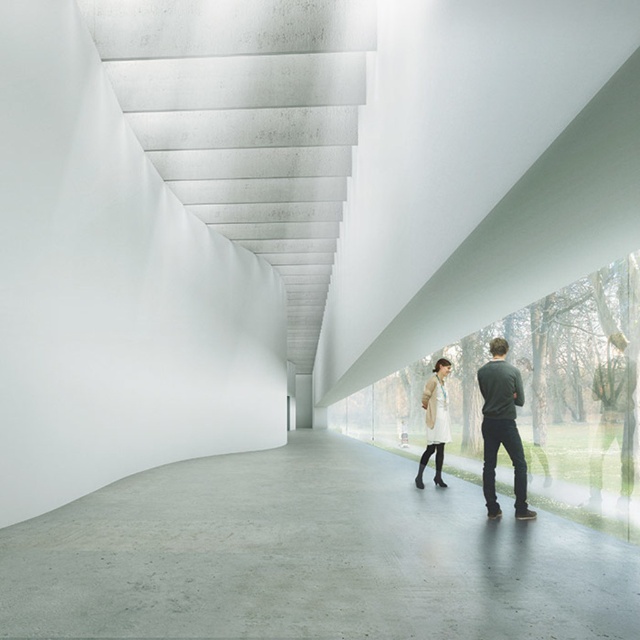
Question: Is gray polished concrete floor at center smaller than dark green sweater at center?

Choices:
 (A) yes
 (B) no

Answer: (B)

Question: Which of the following is the farthest from the observer?

Choices:
 (A) light beige sweater at center
 (B) gray polished concrete floor at center

Answer: (A)

Question: Estimate the real-world distances between objects in this image. Which object is closer to the gray polished concrete floor at center?

Choices:
 (A) beige wool coat at center
 (B) light beige sweater at center

Answer: (B)

Question: Is gray polished concrete floor at center in front of dark green sweater at center?

Choices:
 (A) yes
 (B) no

Answer: (A)

Question: Which point is closer to the camera?

Choices:
 (A) (371, 483)
 (B) (512, 442)
 (C) (444, 422)
 (D) (428, 451)

Answer: (B)

Question: Does light beige sweater at center appear over beige wool coat at center?

Choices:
 (A) yes
 (B) no

Answer: (A)